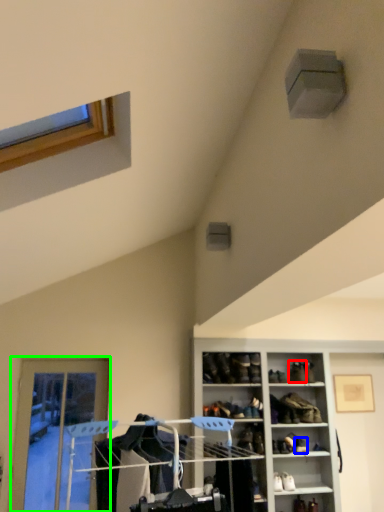
Question: Which object is positioned closest to shoe (highlighted by a red box)? Select from shoe (highlighted by a blue box) and door (highlighted by a green box).

Choices:
 (A) shoe
 (B) door

Answer: (A)